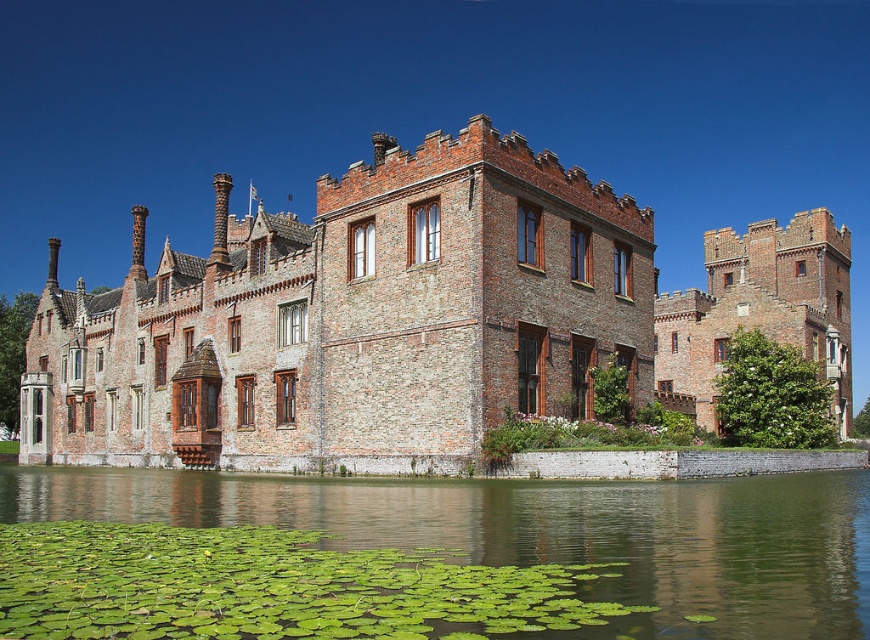
I want to click on brown brick castle at center, so click(410, 317).

Is brown brick castle at center bigger than green leafy water at lower center?

Yes, brown brick castle at center is bigger than green leafy water at lower center.

Image resolution: width=870 pixels, height=640 pixels. Identify the location of brown brick castle at center. (410, 317).